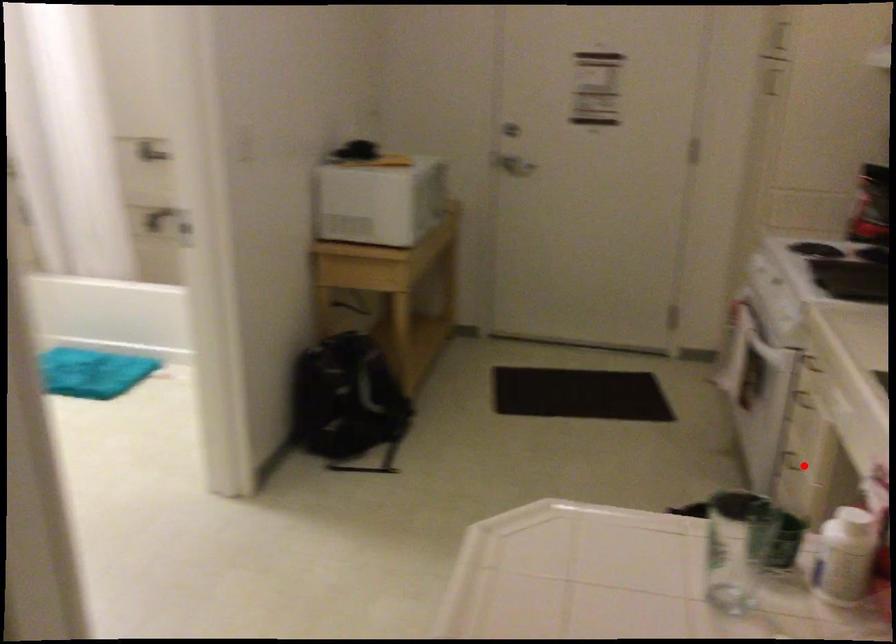
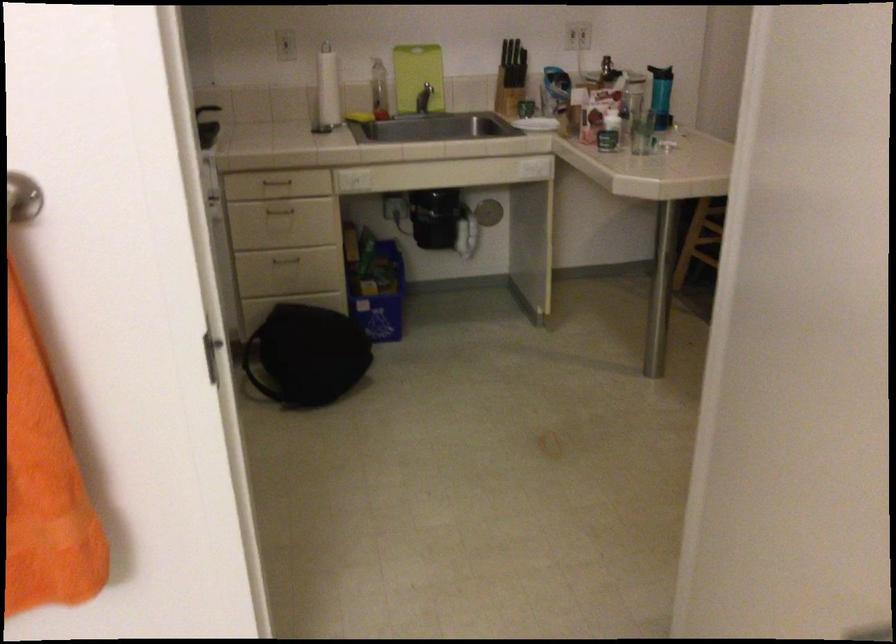
Question: I am providing you with two images of the same scene from different viewpoints. A red point is shown in image1. For the corresponding object point in image2, is it positioned nearer or farther from the camera?

Choices:
 (A) Nearer
 (B) Farther

Answer: (B)